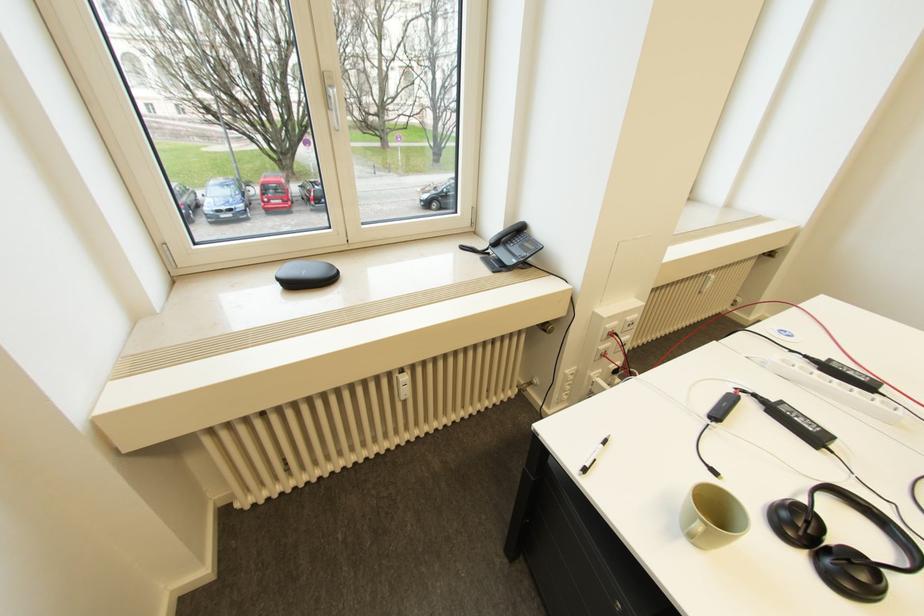
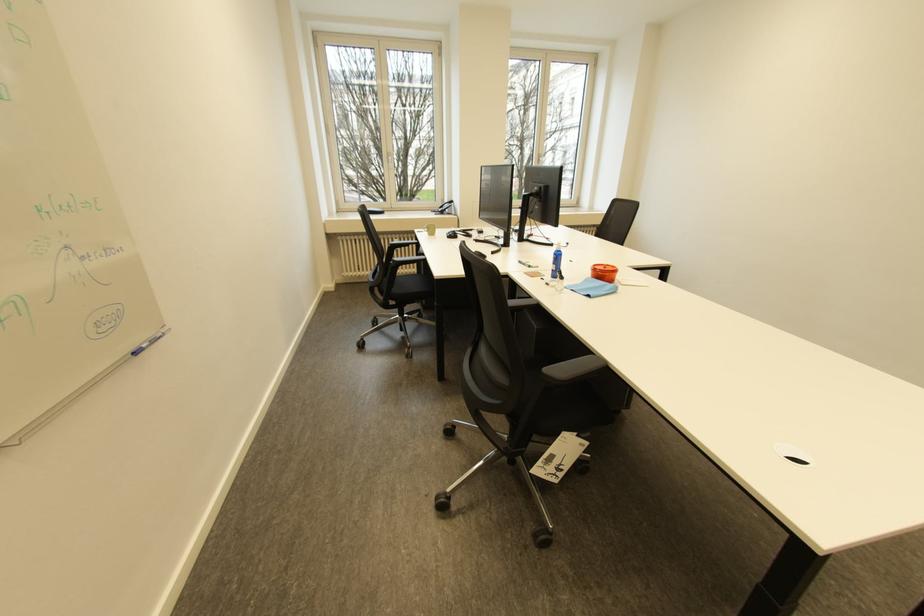
The point at (256, 95) is marked in the first image. Where is the corresponding point in the second image?

(386, 171)